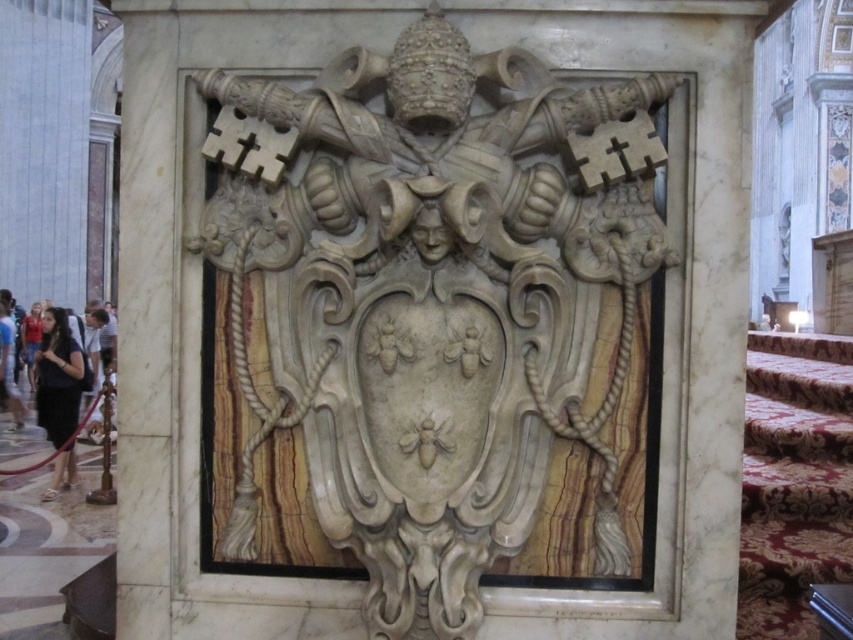
The height and width of the screenshot is (640, 853). What do you see at coordinates (433, 324) in the screenshot?
I see `white marble sculpture at center` at bounding box center [433, 324].

Does white marble sculpture at center appear on the left side of dark brown hair at left?

In fact, white marble sculpture at center is to the right of dark brown hair at left.

Does point (409, 49) come closer to viewer compared to point (44, 404)?

That is True.

Locate an element on the screen. Image resolution: width=853 pixels, height=640 pixels. white marble sculpture at center is located at coordinates click(433, 324).

From the picture: Can you confirm if white marble sculpture at center is positioned below dark brown hair at lower left?

A: No.

Who is more forward, [514,416] or [68,374]?

Point [514,416] is in front.

Which is in front, point (386, 493) or point (70, 353)?

Point (386, 493) is in front.

I want to click on white marble sculpture at center, so click(x=433, y=324).

Which is behind, point (57, 355) or point (59, 467)?

The point (57, 355) is behind.

The width and height of the screenshot is (853, 640). What do you see at coordinates (61, 394) in the screenshot?
I see `dark brown hair at lower left` at bounding box center [61, 394].

This screenshot has width=853, height=640. What do you see at coordinates (61, 394) in the screenshot? I see `dark brown hair at lower left` at bounding box center [61, 394].

Where is `dark brown hair at lower left`? This screenshot has height=640, width=853. dark brown hair at lower left is located at coordinates (61, 394).